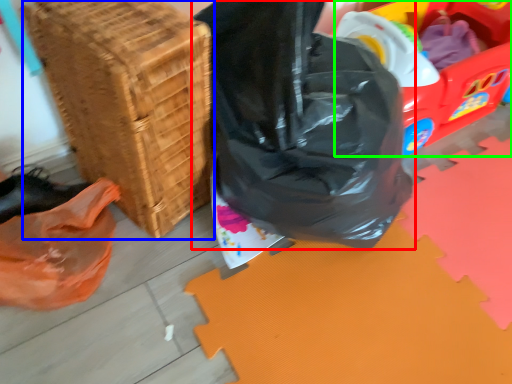
Question: Which is farther away from plastic bag (highlighted by a red box)? basket (highlighted by a blue box) or wagon (highlighted by a green box)?

Choices:
 (A) basket
 (B) wagon

Answer: (B)